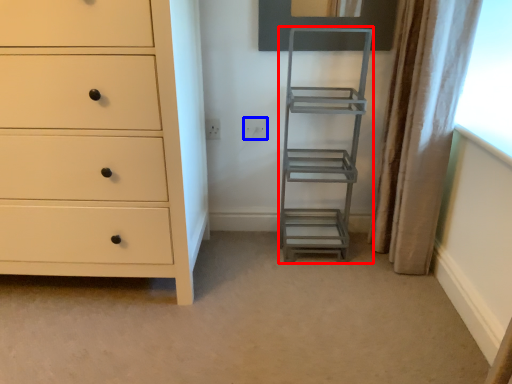
Question: Which point is closer to the camera, ladder (highlighted by a red box) or electric outlet (highlighted by a blue box)?

Choices:
 (A) ladder
 (B) electric outlet

Answer: (A)